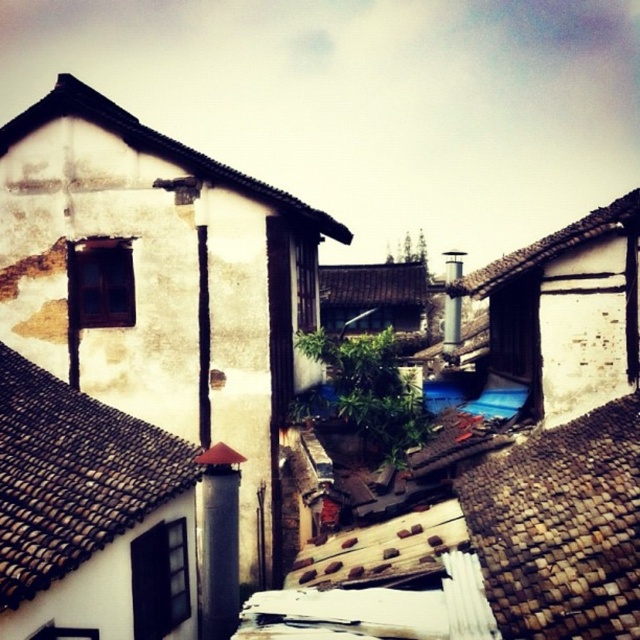
You are standing in the alleyway between two buildings with brown tile roofs. You want to take a photo of the brown tile roof at upper right and the brown tile roof at center. Which roof should you focus on first to ensure it appears larger in your photo?

You should focus on the brown tile roof at upper right first because it is closer to you, making it appear larger in the photo compared to the brown tile roof at center which is farther away.

You are standing at the entrance of the alleyway and want to determine which roof is higher. Based on the scene, which roof, the white textured roof at upper left or the brown tile roof at center, is taller?

The white textured roof at upper left is taller than the brown tile roof at center.

You are standing at the entrance of the alleyway in the traditional architectural scene. You see two points marked on the ground ahead of you. One is at coordinate point (x=589, y=218) and the other is at point (x=388, y=305). Which point is closer to you as you face the alley?

Point (x=589, y=218) is in front of point (x=388, y=305), so it is closer to you as you face the alley.